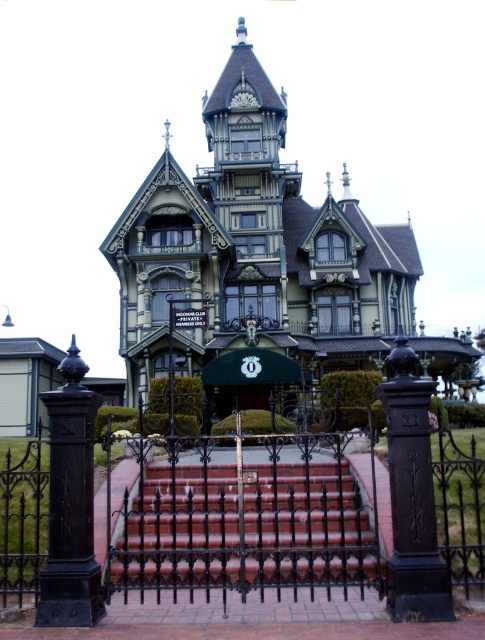
You are a delivery person approaching the mansion and need to locate the street sign to read the address. From your current position at the gate, which object is closer to you between the black wrought iron post at left and the green fabric street sign at center?

The black wrought iron post at left is closer to you since it is positioned in front of the green fabric street sign at center.

Consider the image. You are a delivery person approaching the mansion and need to park your van. The van requires a space that is at least 2 meters wide. Based on the scene, can you determine if the area between the black wrought iron post at left and the green fabric street sign at center is wide enough for your van?

The black wrought iron post at left might be wider than green fabric street sign at center, so it is uncertain if the space between them is wide enough for the van. You should measure the width before parking.

You are a visitor approaching the mansion and see the black wrought iron gate at center and the black wrought iron post at left. Which object is closer to the ground?

The black wrought iron gate at center is located below the black wrought iron post at left, so the gate is closer to the ground.